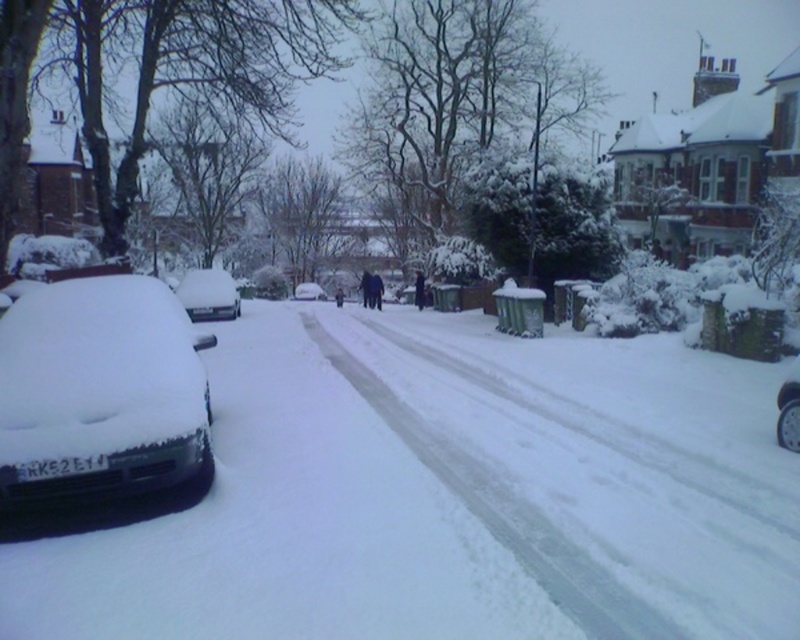
Question: Where is snow-covered car at left located in relation to sleek silver sedan at left in the image?

Choices:
 (A) above
 (B) below

Answer: (B)

Question: Which of the following is the farthest from the observer?

Choices:
 (A) (24, 417)
 (B) (193, 308)

Answer: (B)

Question: Which is nearer to the dark blue fabric at center?

Choices:
 (A) white matte car at center
 (B) sleek silver sedan at left
 (C) black fabric coat at center
 (D) snow-covered car at left

Answer: (C)

Question: Which object appears closest to the camera in this image?

Choices:
 (A) dark blue fabric at center
 (B) sleek silver sedan at left
 (C) white matte car at center
 (D) black fabric coat at center

Answer: (B)

Question: Can you confirm if white matte car at center is positioned above dark blue fabric at center?

Choices:
 (A) yes
 (B) no

Answer: (B)

Question: In this image, where is sleek silver sedan at left located relative to black fabric coat at center?

Choices:
 (A) above
 (B) below

Answer: (B)